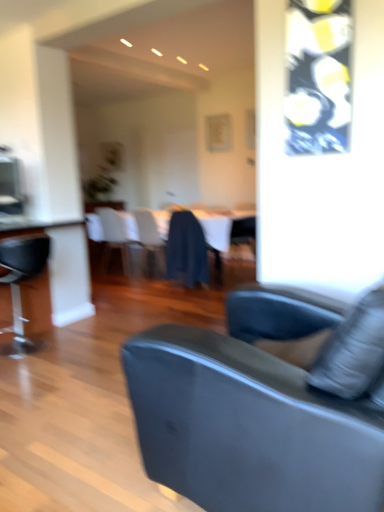
Question: From the image's perspective, is white fabric chair at center, the 5th chair in the front-to-back sequence, beneath white glossy table at center?

Choices:
 (A) no
 (B) yes

Answer: (A)

Question: Is white fabric chair at center, the first chair in the back-to-front sequence, facing towards white glossy table at center?

Choices:
 (A) yes
 (B) no

Answer: (A)

Question: Is white fabric chair at center, the first chair in the back-to-front sequence, taller than white glossy table at center?

Choices:
 (A) no
 (B) yes

Answer: (B)

Question: Can you confirm if white fabric chair at center, the first chair in the back-to-front sequence, is smaller than white glossy table at center?

Choices:
 (A) no
 (B) yes

Answer: (B)

Question: Considering the relative sizes of white fabric chair at center, the 5th chair in the front-to-back sequence, and white glossy table at center in the image provided, is white fabric chair at center, the 5th chair in the front-to-back sequence, shorter than white glossy table at center?

Choices:
 (A) yes
 (B) no

Answer: (B)

Question: Would you say translucent plastic chair at center, the 3th chair positioned from the back, is inside or outside dark blue fabric at center, the fourth chair when ordered from back to front?

Choices:
 (A) inside
 (B) outside

Answer: (B)

Question: Considering the relative positions of translucent plastic chair at center, which appears as the 3th chair when viewed from the front, and dark blue fabric at center, the 2th chair from the front, in the image provided, is translucent plastic chair at center, which appears as the 3th chair when viewed from the front, to the left or to the right of dark blue fabric at center, the 2th chair from the front,?

Choices:
 (A) left
 (B) right

Answer: (A)

Question: Looking at the image, does translucent plastic chair at center, the 3th chair positioned from the back, seem bigger or smaller compared to dark blue fabric at center, the fourth chair when ordered from back to front?

Choices:
 (A) big
 (B) small

Answer: (A)

Question: Is point pos(140,226) positioned closer to the camera than point pos(188,281)?

Choices:
 (A) closer
 (B) farther

Answer: (B)

Question: Would you say white glossy table at center is inside or outside black leather chair at left, acting as the fifth chair starting from the back?

Choices:
 (A) outside
 (B) inside

Answer: (A)

Question: From a real-world perspective, is white glossy table at center above or below black leather chair at left, acting as the fifth chair starting from the back?

Choices:
 (A) below
 (B) above

Answer: (A)

Question: Is white glossy table at center taller or shorter than black leather chair at left, acting as the fifth chair starting from the back?

Choices:
 (A) tall
 (B) short

Answer: (B)

Question: Is white glossy table at center in front of or behind black leather chair at left, which appears as the first chair when viewed from the front, in the image?

Choices:
 (A) front
 (B) behind

Answer: (B)

Question: Relative to white fabric chair at center, the first chair in the back-to-front sequence, is translucent plastic chair at center, the 3th chair positioned from the back, in front or behind?

Choices:
 (A) front
 (B) behind

Answer: (A)

Question: Visually, is translucent plastic chair at center, which appears as the 3th chair when viewed from the front, positioned to the left or to the right of white fabric chair at center, the first chair in the back-to-front sequence?

Choices:
 (A) left
 (B) right

Answer: (B)